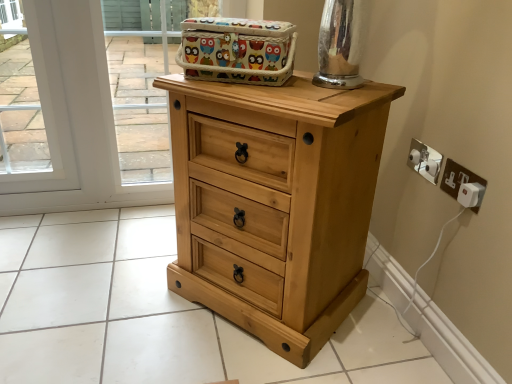
Question: From the image's perspective, is colorful fabric basket at upper center under white plastic electric outlet at right, positioned as the 1th electric outlet in back-to-front order?

Choices:
 (A) no
 (B) yes

Answer: (A)

Question: Does colorful fabric basket at upper center appear on the left side of white plastic electric outlet at right, which is the 2th electric outlet from front to back?

Choices:
 (A) no
 (B) yes

Answer: (B)

Question: Is colorful fabric basket at upper center wider than white plastic electric outlet at right, positioned as the 1th electric outlet in back-to-front order?

Choices:
 (A) no
 (B) yes

Answer: (B)

Question: From a real-world perspective, is colorful fabric basket at upper center on white plastic electric outlet at right, positioned as the 1th electric outlet in back-to-front order?

Choices:
 (A) no
 (B) yes

Answer: (B)

Question: Is the depth of colorful fabric basket at upper center greater than that of white plastic electric outlet at right, which is the 2th electric outlet from front to back?

Choices:
 (A) no
 (B) yes

Answer: (A)

Question: Is white plastic electric outlet at right, positioned as the 1th electric outlet in back-to-front order, completely or partially inside colorful fabric basket at upper center?

Choices:
 (A) no
 (B) yes

Answer: (A)

Question: Could wooden basket at upper center be considered to be inside white plastic plug at lower right, the 1th electric outlet positioned from the front?

Choices:
 (A) yes
 (B) no

Answer: (B)

Question: Could you tell me if white plastic plug at lower right, the 1th electric outlet positioned from the front, is facing wooden basket at upper center?

Choices:
 (A) no
 (B) yes

Answer: (A)

Question: Can you confirm if white plastic plug at lower right, the 1th electric outlet positioned from the front, is smaller than wooden basket at upper center?

Choices:
 (A) yes
 (B) no

Answer: (A)

Question: Is white plastic plug at lower right, marked as the second electric outlet in a back-to-front arrangement, far from wooden basket at upper center?

Choices:
 (A) no
 (B) yes

Answer: (B)

Question: Is white plastic plug at lower right, the 1th electric outlet positioned from the front, bigger than wooden basket at upper center?

Choices:
 (A) no
 (B) yes

Answer: (A)

Question: From a real-world perspective, is white plastic plug at lower right, the 1th electric outlet positioned from the front, positioned under wooden basket at upper center based on gravity?

Choices:
 (A) yes
 (B) no

Answer: (B)

Question: Is the surface of colorful fabric basket at upper center in direct contact with wooden basket at upper center?

Choices:
 (A) no
 (B) yes

Answer: (A)